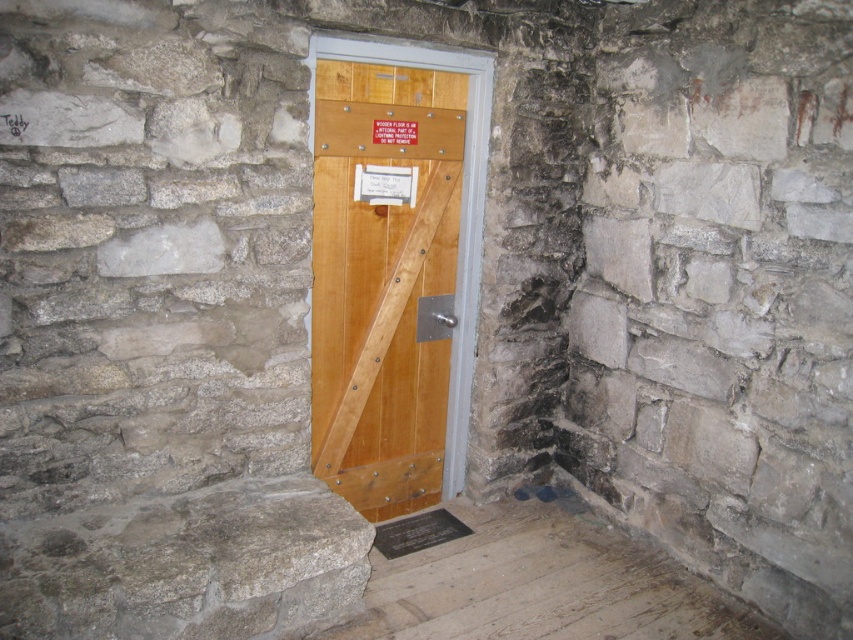
Which is in front, point (605, 605) or point (405, 180)?

Positioned in front is point (605, 605).

Does point (717, 602) come in front of point (399, 172)?

Yes, it is in front of point (399, 172).

The width and height of the screenshot is (853, 640). In order to click on wooden floor at lower center in this screenshot , I will do `click(541, 586)`.

Does wooden door at center appear under wooden floor at lower center?

No.

Does wooden door at center have a smaller size compared to wooden floor at lower center?

Actually, wooden door at center might be larger than wooden floor at lower center.

Who is more distant from viewer, (x=457, y=483) or (x=479, y=579)?

Point (x=457, y=483)

This screenshot has height=640, width=853. In order to click on wooden door at center in this screenshot , I will do `click(395, 269)`.

Is wooden door at center taller than wooden sign at center?

Correct, wooden door at center is much taller as wooden sign at center.

Can you confirm if wooden door at center is positioned to the left of wooden sign at center?

In fact, wooden door at center is to the right of wooden sign at center.

Is point (378, 83) positioned before point (355, 188)?

Yes.

At what (x,y) coordinates should I click in order to perform the action: click on wooden door at center. Please return your answer as a coordinate pair (x, y). The height and width of the screenshot is (640, 853). Looking at the image, I should click on (395, 269).